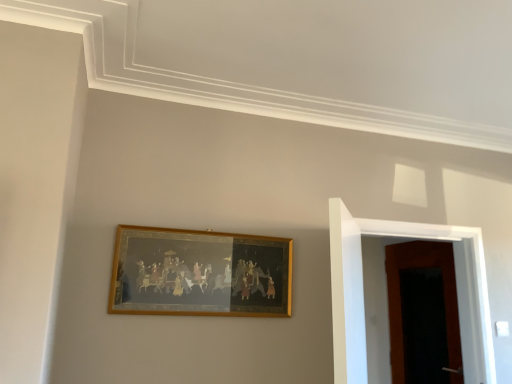
Question: From a real-world perspective, is wooden door at right, positioned as the first door in back-to-front order, positioned under wooden door at right, which appears as the first door when viewed from the front, based on gravity?

Choices:
 (A) no
 (B) yes

Answer: (B)

Question: Is wooden door at right, which appears as the 2th door when viewed from the front, with wooden door at right, which is the second door in back-to-front order?

Choices:
 (A) no
 (B) yes

Answer: (A)

Question: Is wooden door at right, which appears as the 2th door when viewed from the front, shorter than wooden door at right, which is the second door in back-to-front order?

Choices:
 (A) yes
 (B) no

Answer: (B)

Question: Is wooden door at right, positioned as the first door in back-to-front order, turned away from wooden door at right, which is the second door in back-to-front order?

Choices:
 (A) no
 (B) yes

Answer: (A)

Question: Could you tell me if wooden door at right, positioned as the first door in back-to-front order, is turned towards wooden door at right, which is the second door in back-to-front order?

Choices:
 (A) no
 (B) yes

Answer: (A)

Question: From their relative heights in the image, would you say wooden door at right, which appears as the first door when viewed from the front, is taller or shorter than wooden door at right, positioned as the first door in back-to-front order?

Choices:
 (A) short
 (B) tall

Answer: (A)

Question: Considering their positions, is wooden door at right, which appears as the first door when viewed from the front, located in front of or behind wooden door at right, which appears as the 2th door when viewed from the front?

Choices:
 (A) behind
 (B) front

Answer: (B)

Question: From the image's perspective, is wooden door at right, which appears as the first door when viewed from the front, above or below wooden door at right, positioned as the first door in back-to-front order?

Choices:
 (A) below
 (B) above

Answer: (B)

Question: Is wooden door at right, which is the second door in back-to-front order, wider or thinner than wooden door at right, positioned as the first door in back-to-front order?

Choices:
 (A) thin
 (B) wide

Answer: (B)

Question: Do you think wooden door at right, which appears as the 2th door when viewed from the front, is within wooden door at right, which is the second door in back-to-front order, or outside of it?

Choices:
 (A) outside
 (B) inside

Answer: (A)

Question: Is point (440, 299) closer or farther from the camera than point (338, 223)?

Choices:
 (A) farther
 (B) closer

Answer: (A)

Question: Looking at their shapes, would you say wooden door at right, positioned as the first door in back-to-front order, is wider or thinner than wooden door at right, which appears as the first door when viewed from the front?

Choices:
 (A) thin
 (B) wide

Answer: (A)

Question: From their relative heights in the image, would you say wooden door at right, which appears as the 2th door when viewed from the front, is taller or shorter than wooden door at right, which appears as the first door when viewed from the front?

Choices:
 (A) tall
 (B) short

Answer: (A)

Question: Relative to gold-framed painting at center, is wooden door at right, positioned as the first door in back-to-front order, in front or behind?

Choices:
 (A) front
 (B) behind

Answer: (B)

Question: From the image's perspective, relative to gold-framed painting at center, is wooden door at right, which appears as the 2th door when viewed from the front, above or below?

Choices:
 (A) above
 (B) below

Answer: (B)